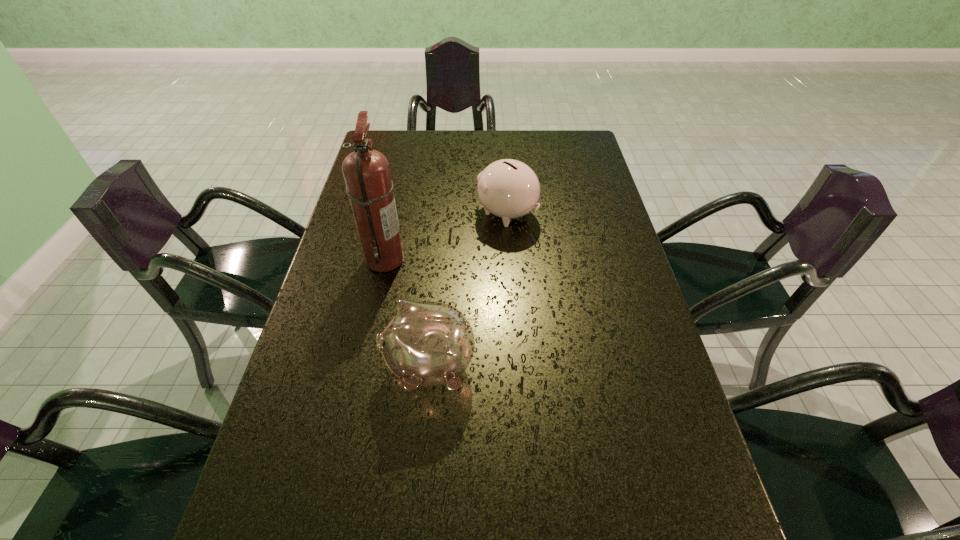
The height and width of the screenshot is (540, 960). I want to click on vacant space in between the nearer piggy bank and the right piggy bank, so click(x=468, y=289).

Identify the location of free space that is in between the nearer piggy bank and the farthest object. pos(468,289).

Identify which object is the second closest to the nearest object. Please provide its 2D coordinates. Your answer should be formatted as a tuple, i.e. [(x, y)], where the tuple contains the x and y coordinates of a point satisfying the conditions above.

[(507, 188)]

Identify the location of object that is the second closest to the nearest object. The width and height of the screenshot is (960, 540). (x=507, y=188).